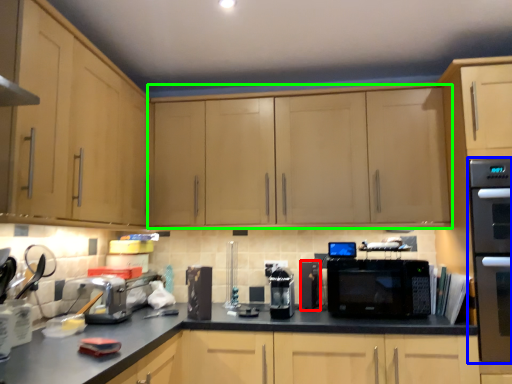
Question: Which object is the closest to the appliance (highlighted by a red box)? Choose among these: home appliance (highlighted by a blue box) or cabinetry (highlighted by a green box).

Choices:
 (A) home appliance
 (B) cabinetry

Answer: (B)